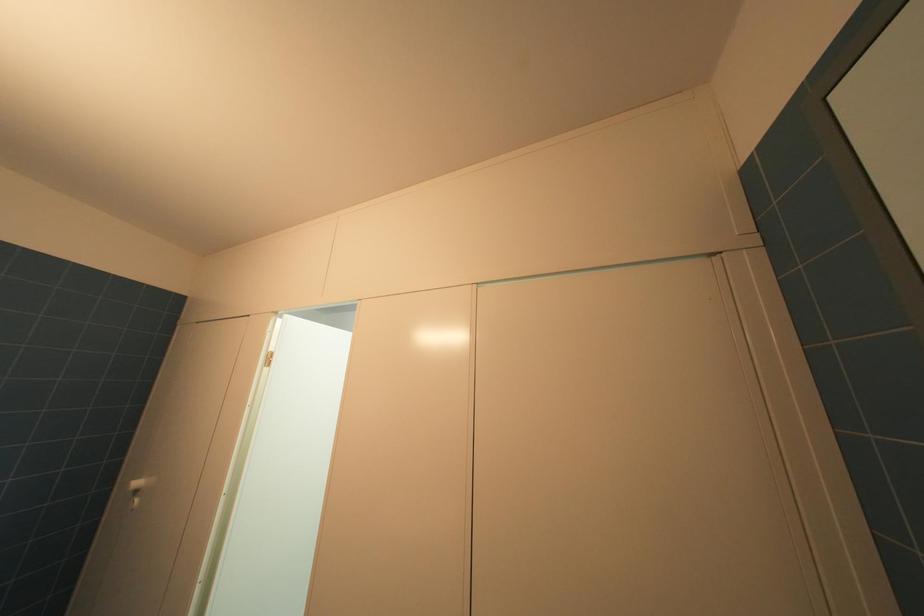
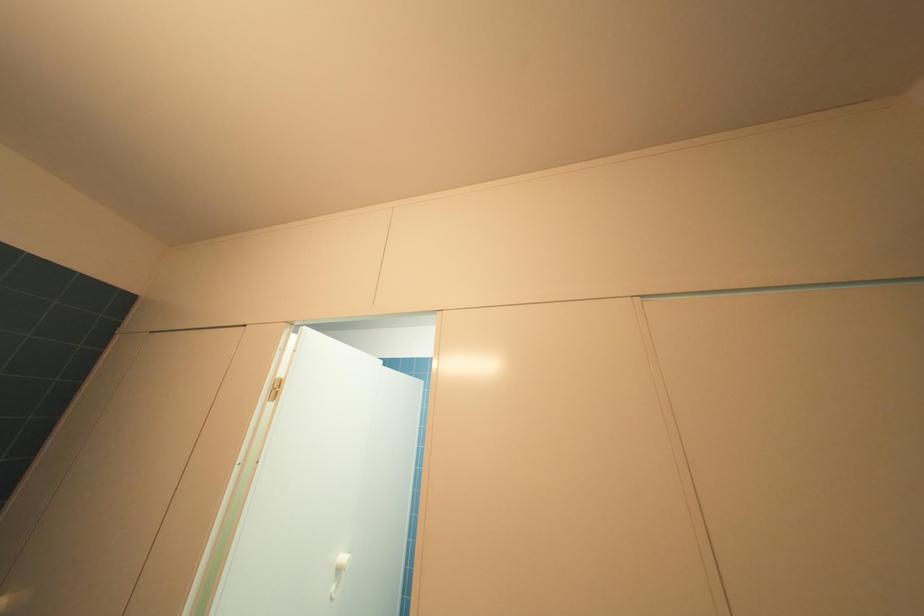
Which direction would the cameraman need to move to produce the second image?

The cameraman moved toward left, forward.